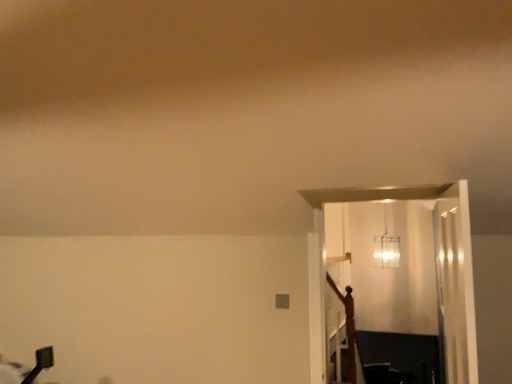
Question: From the image's perspective, is clear glass door at right below translucent glass pendant light at upper center?

Choices:
 (A) yes
 (B) no

Answer: (A)

Question: Considering the relative positions of clear glass door at right and translucent glass pendant light at upper center in the image provided, is clear glass door at right behind translucent glass pendant light at upper center?

Choices:
 (A) no
 (B) yes

Answer: (A)

Question: From a real-world perspective, is clear glass door at right beneath translucent glass pendant light at upper center?

Choices:
 (A) yes
 (B) no

Answer: (A)

Question: Is the position of clear glass door at right less distant than that of translucent glass pendant light at upper center?

Choices:
 (A) yes
 (B) no

Answer: (A)

Question: Does clear glass door at right have a lesser height compared to translucent glass pendant light at upper center?

Choices:
 (A) no
 (B) yes

Answer: (A)

Question: Which is correct: wooden crucifix at right is inside translucent glass pendant light at upper center, or outside of it?

Choices:
 (A) outside
 (B) inside

Answer: (A)

Question: In the image, is wooden crucifix at right positioned in front of or behind translucent glass pendant light at upper center?

Choices:
 (A) behind
 (B) front

Answer: (B)

Question: From a real-world perspective, is wooden crucifix at right physically located above or below translucent glass pendant light at upper center?

Choices:
 (A) below
 (B) above

Answer: (A)

Question: Would you say wooden crucifix at right is to the left or to the right of translucent glass pendant light at upper center in the picture?

Choices:
 (A) right
 (B) left

Answer: (B)

Question: Is translucent glass pendant light at upper center in front of or behind clear glass door at right in the image?

Choices:
 (A) front
 (B) behind

Answer: (B)

Question: Considering the positions of point (382, 259) and point (437, 205), is point (382, 259) closer or farther from the camera than point (437, 205)?

Choices:
 (A) closer
 (B) farther

Answer: (B)

Question: Based on their sizes in the image, would you say translucent glass pendant light at upper center is bigger or smaller than clear glass door at right?

Choices:
 (A) big
 (B) small

Answer: (B)

Question: From the image's perspective, relative to clear glass door at right, is translucent glass pendant light at upper center above or below?

Choices:
 (A) below
 (B) above

Answer: (B)

Question: Considering the relative positions of translucent glass pendant light at upper center and wooden crucifix at right in the image provided, is translucent glass pendant light at upper center to the left or to the right of wooden crucifix at right?

Choices:
 (A) right
 (B) left

Answer: (A)

Question: Considering the positions of translucent glass pendant light at upper center and wooden crucifix at right in the image, is translucent glass pendant light at upper center bigger or smaller than wooden crucifix at right?

Choices:
 (A) small
 (B) big

Answer: (B)